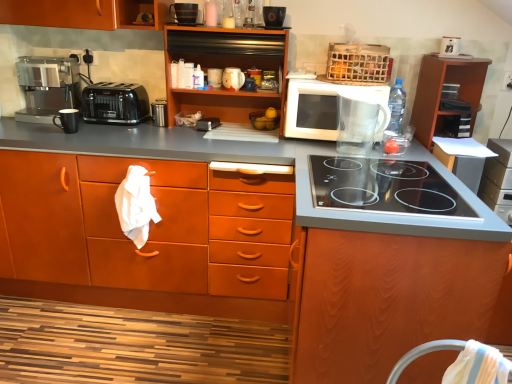
Find the location of a particular element. The height and width of the screenshot is (384, 512). vacant space situated on the left part of metallic silver toaster at center, the fourth appliance in the right-to-left sequence is located at coordinates (133, 121).